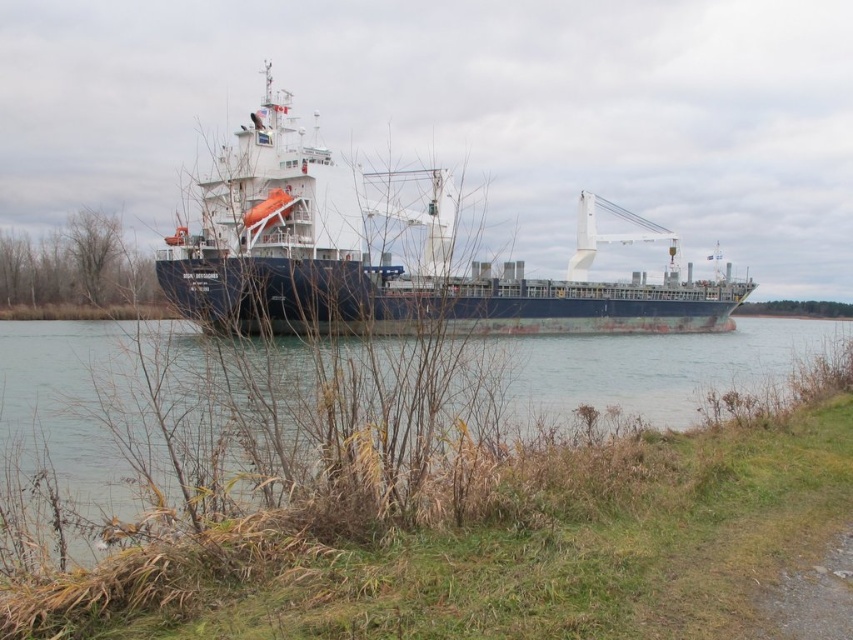
Is point (280, 92) positioned behind point (125, 339)?

That is True.

Which is behind, point (657, 285) or point (677, 376)?

Point (657, 285)

The height and width of the screenshot is (640, 853). I want to click on blue matte cargo ship at center, so click(x=390, y=259).